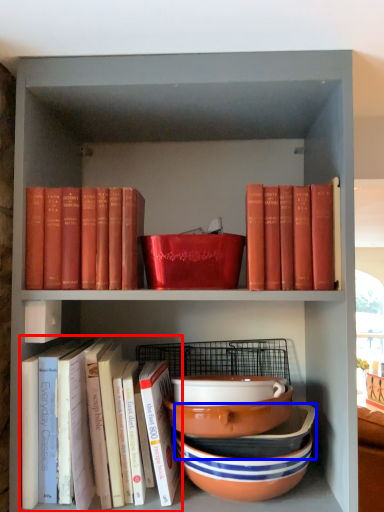
Question: Which point is further to the camera, book (highlighted by a red box) or bowl (highlighted by a blue box)?

Choices:
 (A) book
 (B) bowl

Answer: (B)